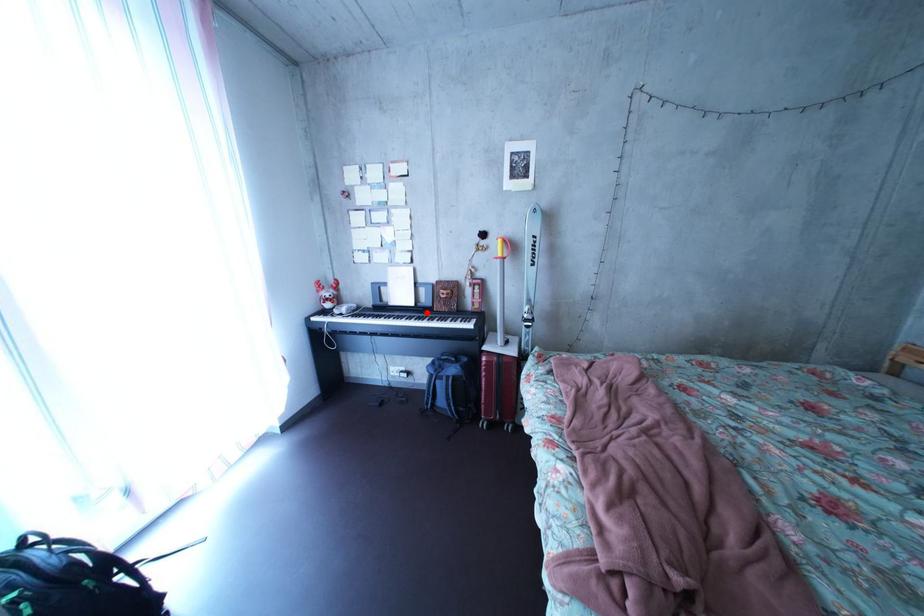
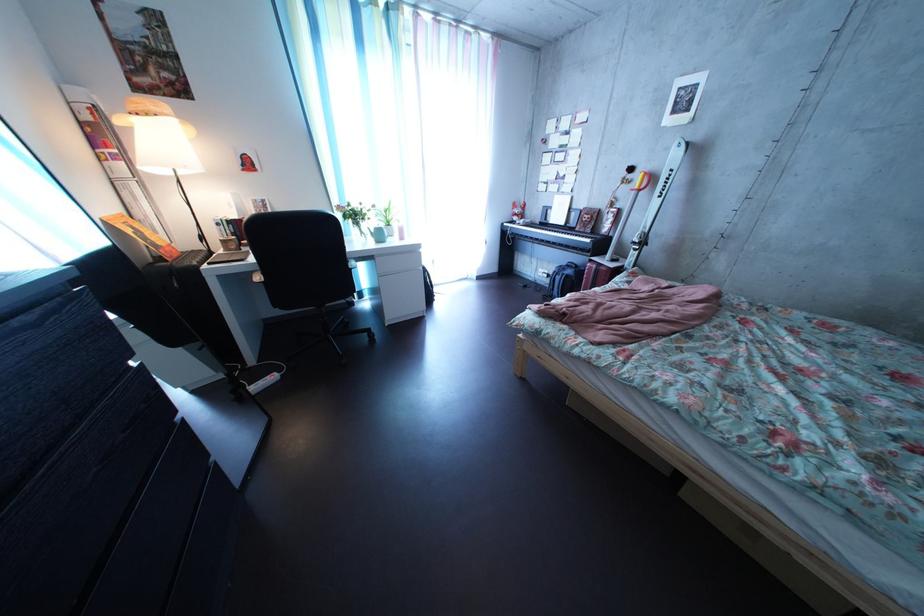
Locate, in the second image, the point that corresponds to the highlighted location in the first image.

(577, 232)